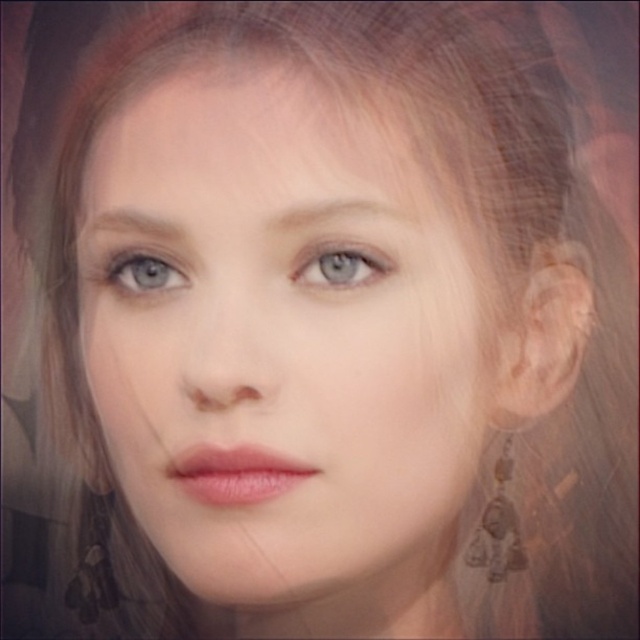
You are a makeup artist preparing to apply eyeliner to a client. The client has a smooth skin face at center and a blue glossy eye at upper left. Given that the distance between these two features is 2.67 inches, will you need to adjust your usual eyeliner application technique for this client?

The distance between the smooth skin face at center and the blue glossy eye at upper left is 2.67 inches. Since eyeliner application typically requires adjustments based on eye placement, you should consider modifying your technique to accommodate the specific spacing between these features for precise application.

You are a photographer adjusting the focus on a camera. You notice the smooth skin face at center and the blue matte eye at center in your viewfinder. Which object should you focus on first to ensure both are in focus, considering their sizes?

The smooth skin face at center is bigger than the blue matte eye at center, so you should focus on the smooth skin face at center first to ensure both are in focus.

You are a photographer adjusting the focus of your camera. You notice the smooth skin face at center and the blue glossy eye at upper left in your viewfinder. Which object should you focus on to ensure the subject is sharp and clear?

You should focus on the smooth skin face at center because it is in front of the blue glossy eye at upper left, making it the primary subject closer to the camera.